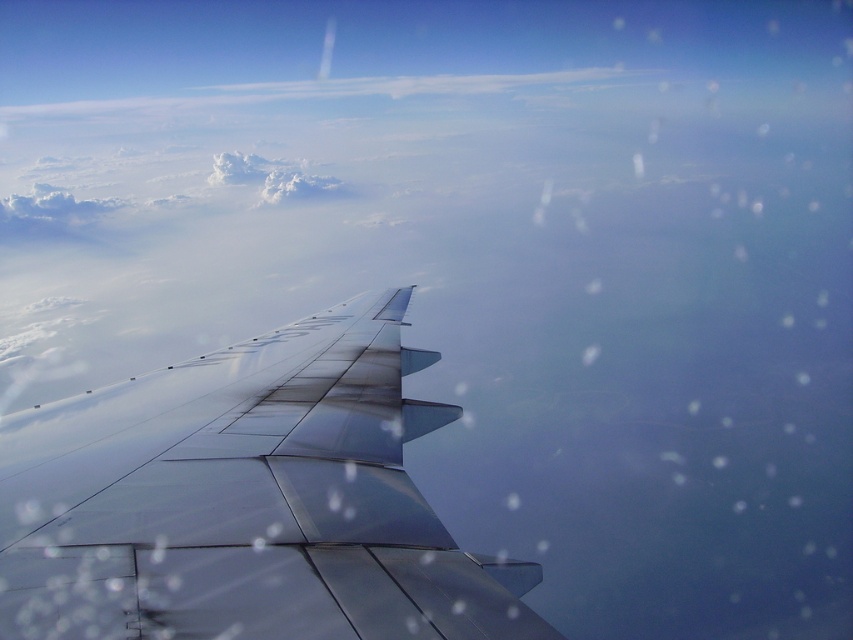
Question: Can you confirm if metallic silver wing at lower left is positioned above white fluffy cloud at upper center?

Choices:
 (A) yes
 (B) no

Answer: (B)

Question: Which point is farther to the camera?

Choices:
 (A) (106, 568)
 (B) (316, 179)

Answer: (B)

Question: Which of the following is the farthest from the observer?

Choices:
 (A) (210, 184)
 (B) (28, 465)

Answer: (A)

Question: Can you confirm if metallic silver wing at lower left is thinner than white fluffy cloud at upper center?

Choices:
 (A) no
 (B) yes

Answer: (B)

Question: In this image, where is metallic silver wing at lower left located relative to white fluffy cloud at upper center?

Choices:
 (A) below
 (B) above

Answer: (A)